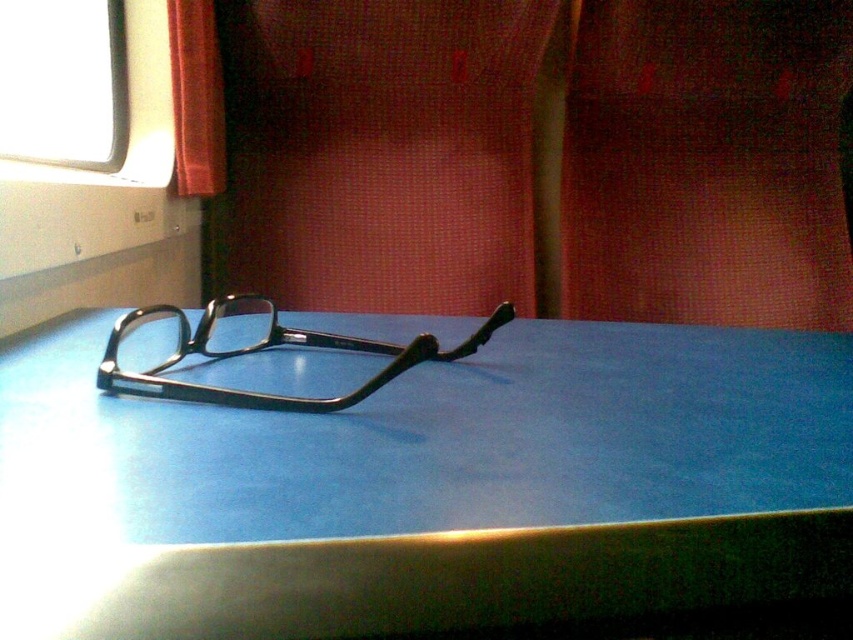
Question: Among these points, which one is farthest from the camera?

Choices:
 (A) (271, 310)
 (B) (529, 420)
 (C) (322, 141)
 (D) (834, 102)

Answer: (D)

Question: Which of the following is the farthest from the observer?

Choices:
 (A) blue matte table at center
 (B) matte black glasses at center

Answer: (B)

Question: Does matte red curtain at center appear on the left side of matte black glasses at center?

Choices:
 (A) no
 (B) yes

Answer: (A)

Question: Is matte red curtain at center above matte black glasses at center?

Choices:
 (A) yes
 (B) no

Answer: (A)

Question: Is blue matte table at center closer to the viewer compared to matte red curtain at center?

Choices:
 (A) yes
 (B) no

Answer: (A)

Question: Which point is closer to the camera?

Choices:
 (A) (842, 81)
 (B) (184, 36)
 (C) (415, 358)
 (D) (473, 579)

Answer: (D)